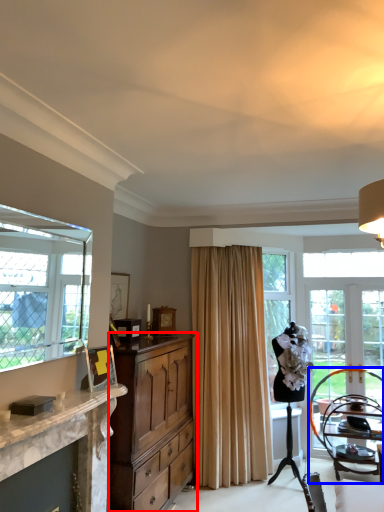
Question: Which object is further to the camera taking this photo, cabinetry (highlighted by a red box) or chair (highlighted by a blue box)?

Choices:
 (A) cabinetry
 (B) chair

Answer: (B)